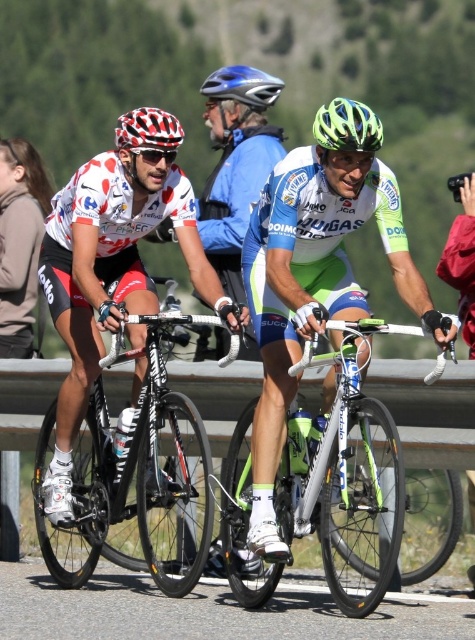
Question: Considering the real-world distances, which object is closest to the shiny black frame at left?

Choices:
 (A) checkered fabric helmet at left
 (B) neon green matte helmet at center
 (C) white/green metallic bicycle at center
 (D) blue glossy bicycle helmet at upper center

Answer: (C)

Question: Is white/green metallic bicycle at center further to the viewer compared to shiny black frame at left?

Choices:
 (A) no
 (B) yes

Answer: (A)

Question: Which point is farther from the camera taking this photo?

Choices:
 (A) (154, 452)
 (B) (326, 564)
 (C) (265, 237)
 (D) (235, 97)

Answer: (D)

Question: Which of the following is the farthest from the observer?

Choices:
 (A) (146, 138)
 (B) (91, 451)
 (C) (325, 410)
 (D) (97, 308)

Answer: (B)

Question: Can you confirm if neon green matte helmet at center is wider than blue glossy bicycle helmet at upper center?

Choices:
 (A) yes
 (B) no

Answer: (B)

Question: Does green matte helmet at center appear on the left side of neon green matte helmet at center?

Choices:
 (A) no
 (B) yes

Answer: (B)